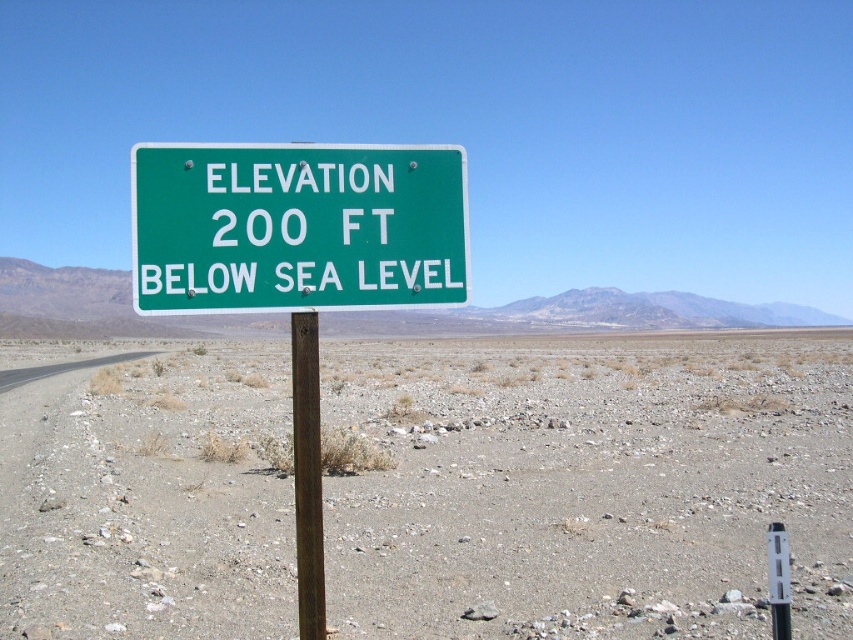
Who is shorter, green metal sign at center or brown wooden post at center?

green metal sign at center is shorter.

Does green metal sign at center have a lesser height compared to brown wooden post at center?

Yes.

The height and width of the screenshot is (640, 853). I want to click on green metal sign at center, so click(296, 227).

Is gray gravel desert at center below brown wooden post at center?

Yes, gray gravel desert at center is below brown wooden post at center.

Which of these two, gray gravel desert at center or brown wooden post at center, stands shorter?

Standing shorter between the two is gray gravel desert at center.

Where is `gray gravel desert at center`? gray gravel desert at center is located at coordinates (590, 484).

Who is taller, gray gravel desert at center or green metal sign at center?

With more height is gray gravel desert at center.

Who is more distant from viewer, (550, 435) or (132, 285)?

The point (550, 435) is more distant.

Where is `gray gravel desert at center`? This screenshot has width=853, height=640. gray gravel desert at center is located at coordinates (590, 484).